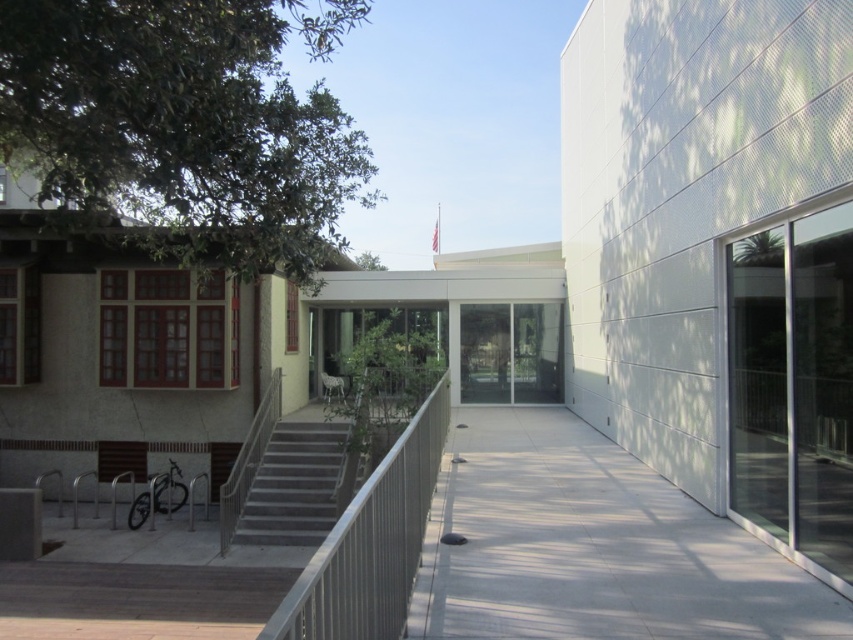
You are a maintenance worker needing to access the gray concrete stairs at center for repairs. However, the gray concrete pavement at center is blocking your path. Can you reach the stairs without moving the pavement?

The gray concrete pavement at center is positioned over the gray concrete stairs at center, so you cannot reach the stairs without moving the pavement.